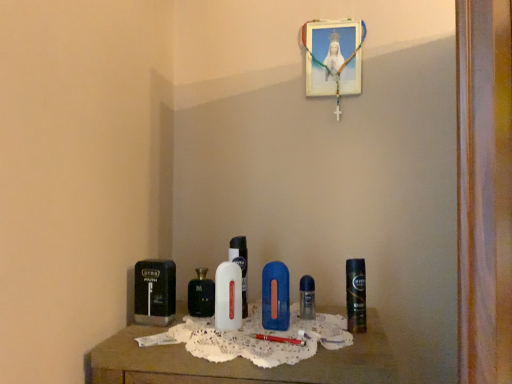
Find the location of `blank space situated above wooden table at center (from a real-world perspective)`. blank space situated above wooden table at center (from a real-world perspective) is located at coordinates (238, 322).